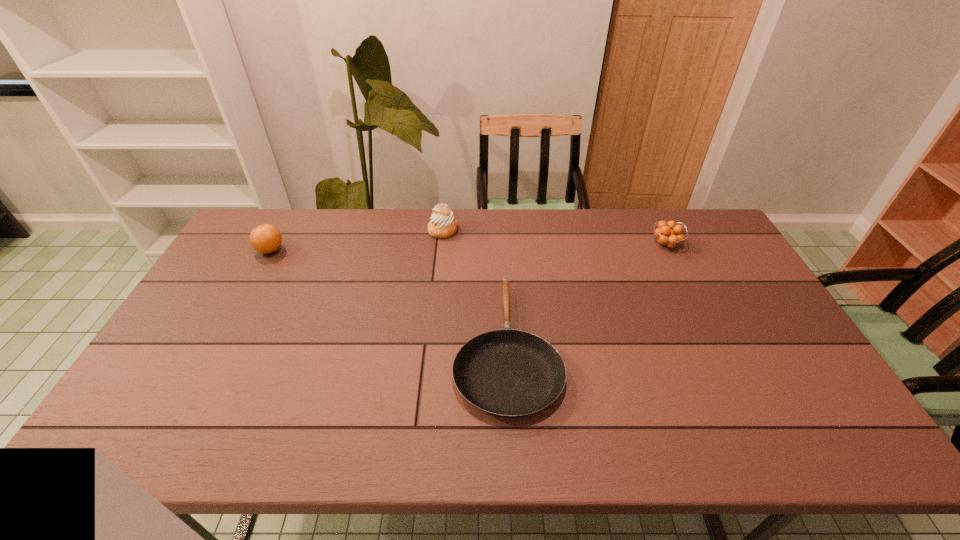
Locate an element on the screen. empty space that is in between the frying pan and the pastry is located at coordinates (475, 288).

Identify which object is located as the third nearest to the second object from left to right. Please provide its 2D coordinates. Your answer should be formatted as a tuple, i.e. [(x, y)], where the tuple contains the x and y coordinates of a point satisfying the conditions above.

[(668, 234)]

Select which object appears as the closest to the rightmost object. Please provide its 2D coordinates. Your answer should be formatted as a tuple, i.e. [(x, y)], where the tuple contains the x and y coordinates of a point satisfying the conditions above.

[(508, 373)]

Where is `free space that satisfies the following two spatial constraints: 1. on the back side of the pastry; 2. on the right side of the left orange fruit`? The image size is (960, 540). free space that satisfies the following two spatial constraints: 1. on the back side of the pastry; 2. on the right side of the left orange fruit is located at coordinates (281, 230).